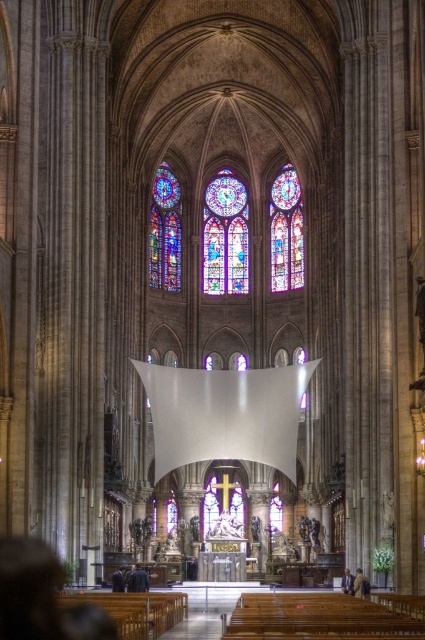
Question: Which of these objects is positioned farthest from the multicolored stained glass at upper center?

Choices:
 (A) stained glass window at center
 (B) stained glass window at left

Answer: (B)

Question: Which of the following is the closest to the observer?

Choices:
 (A) stained glass window at left
 (B) multicolored stained glass at upper center
 (C) stained glass window at center

Answer: (A)

Question: Is multicolored stained glass at upper center further to the viewer compared to stained glass window at left?

Choices:
 (A) yes
 (B) no

Answer: (A)

Question: Is stained glass window at center above stained glass window at left?

Choices:
 (A) no
 (B) yes

Answer: (A)

Question: Which point is farther to the camera?

Choices:
 (A) (280, 170)
 (B) (170, 221)

Answer: (A)

Question: Does multicolored stained glass at upper center have a larger size compared to stained glass window at center?

Choices:
 (A) yes
 (B) no

Answer: (A)